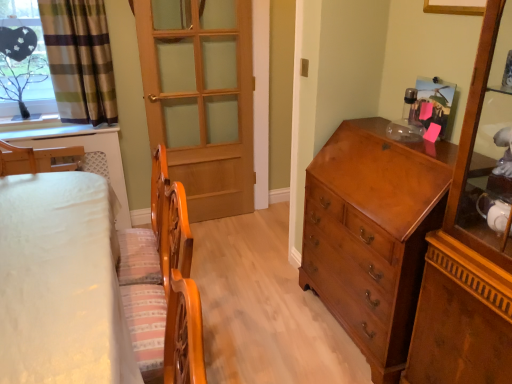
Question: In terms of width, does white fabric bed at left look wider or thinner when compared to shiny brown wooden chest of drawers at right?

Choices:
 (A) thin
 (B) wide

Answer: (B)

Question: From a real-world perspective, relative to shiny brown wooden chest of drawers at right, is white fabric bed at left vertically above or below?

Choices:
 (A) above
 (B) below

Answer: (B)

Question: Which of these objects is positioned farthest from the shiny brown cabinet at right?

Choices:
 (A) shiny brown wooden chest of drawers at right
 (B) wooden door at center
 (C) white fabric bed at left
 (D) green plaid fabric at upper left
 (E) clear glass tree at upper left

Answer: (E)

Question: Which object is the farthest from the green plaid fabric at upper left?

Choices:
 (A) shiny brown wooden chest of drawers at right
 (B) white fabric bed at left
 (C) clear glass tree at upper left
 (D) wooden door at center
 (E) shiny brown cabinet at right

Answer: (E)